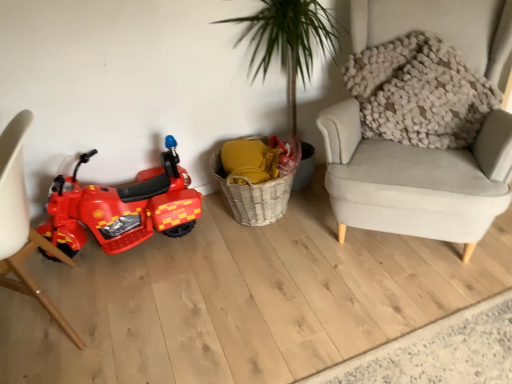
Question: From the image's perspective, is matte white chair at left located above or below shiny plastic toy motorcycle at left?

Choices:
 (A) below
 (B) above

Answer: (A)

Question: Is matte white chair at left inside the boundaries of shiny plastic toy motorcycle at left, or outside?

Choices:
 (A) outside
 (B) inside

Answer: (A)

Question: Based on their relative distances, which object is nearer to the shiny plastic toy motorcycle at left?

Choices:
 (A) matte white chair at left
 (B) woven basket at center

Answer: (A)

Question: Which object is the closest to the matte white chair at left?

Choices:
 (A) woven basket at center
 (B) shiny plastic toy motorcycle at left

Answer: (B)